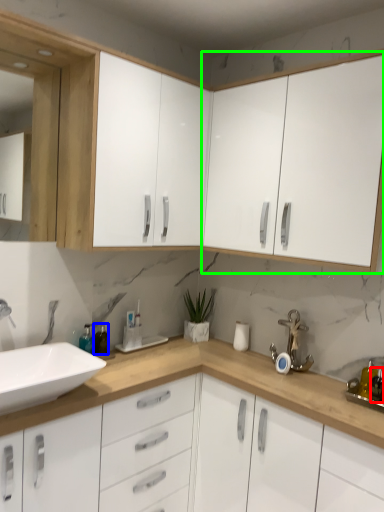
Question: Based on their relative distances, which object is nearer to toiletry (highlighted by a red box)? Choose from bottle (highlighted by a blue box) and cabinetry (highlighted by a green box).

Choices:
 (A) bottle
 (B) cabinetry

Answer: (B)